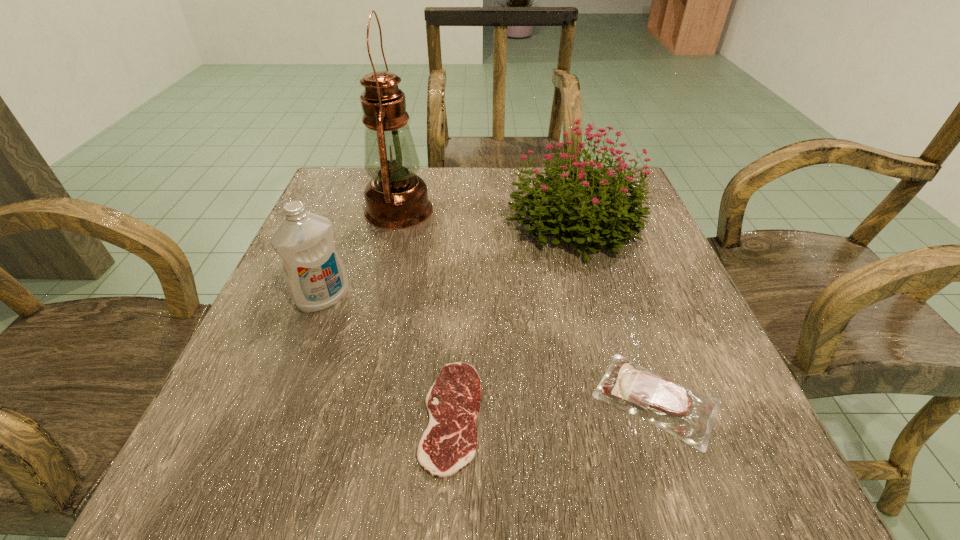
Where is `object that is at the near right corner`? The width and height of the screenshot is (960, 540). object that is at the near right corner is located at coordinates (663, 402).

This screenshot has width=960, height=540. What are the coordinates of `blank space at the far edge` in the screenshot? It's located at (496, 202).

At what (x,y) coordinates should I click in order to perform the action: click on free spot at the near edge of the desktop. Please return your answer as a coordinate pair (x, y). The image size is (960, 540). Looking at the image, I should click on (622, 495).

Identify the location of vacant point at the left edge. (341, 244).

Identify the location of vacant space at the right edge of the desktop. This screenshot has width=960, height=540. (662, 286).

The width and height of the screenshot is (960, 540). Find the location of `free space at the far left corner`. free space at the far left corner is located at coordinates (362, 184).

Find the location of a particular element. Image resolution: width=960 pixels, height=540 pixels. vacant space in between the bouquet and the third object from left to right is located at coordinates (513, 319).

This screenshot has height=540, width=960. Find the location of `free spot between the oil lamp and the shortest object`. free spot between the oil lamp and the shortest object is located at coordinates (425, 313).

Find the location of `vacant point located between the third farthest object and the left steak`. vacant point located between the third farthest object and the left steak is located at coordinates (388, 357).

I want to click on free spot between the bouquet and the tallest object, so click(486, 216).